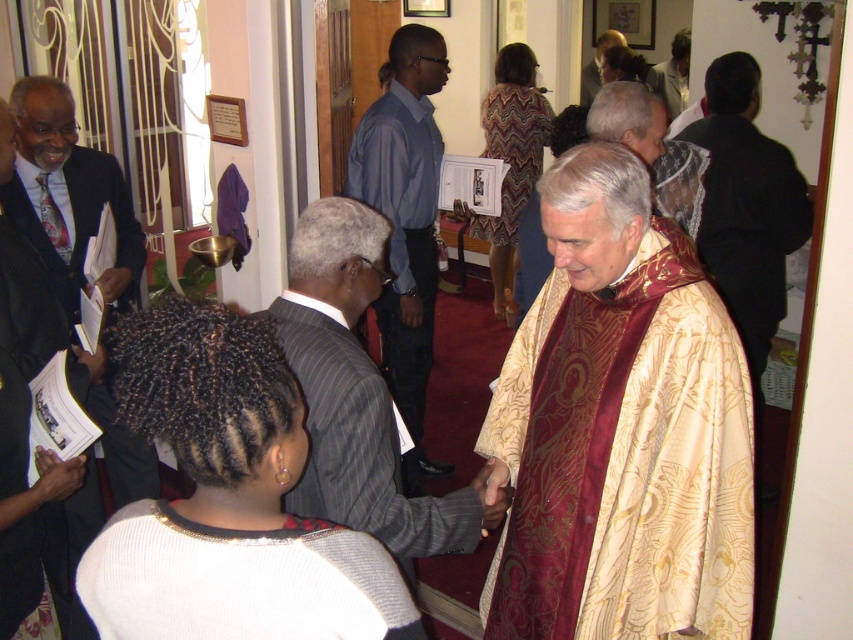
Question: Among these points, which one is farthest from the camera?

Choices:
 (A) (337, 205)
 (B) (405, 378)
 (C) (595, 65)
 (D) (200, 557)

Answer: (C)

Question: Does white knitted sweater at lower center appear over gray pinstripe suit at center?

Choices:
 (A) yes
 (B) no

Answer: (B)

Question: Can you confirm if white knitted sweater at lower center is smaller than dark suit at left?

Choices:
 (A) yes
 (B) no

Answer: (A)

Question: Which of the following is the farthest from the observer?

Choices:
 (A) light brown leather jacket at upper center
 (B) multicolored patterned dress at center
 (C) black satin robe at center

Answer: (A)

Question: Does gray pinstripe suit at center have a greater width compared to light brown leather jacket at upper center?

Choices:
 (A) no
 (B) yes

Answer: (B)

Question: Which point is closer to the camera?

Choices:
 (A) light brown leather jacket at upper center
 (B) dark suit at left

Answer: (B)